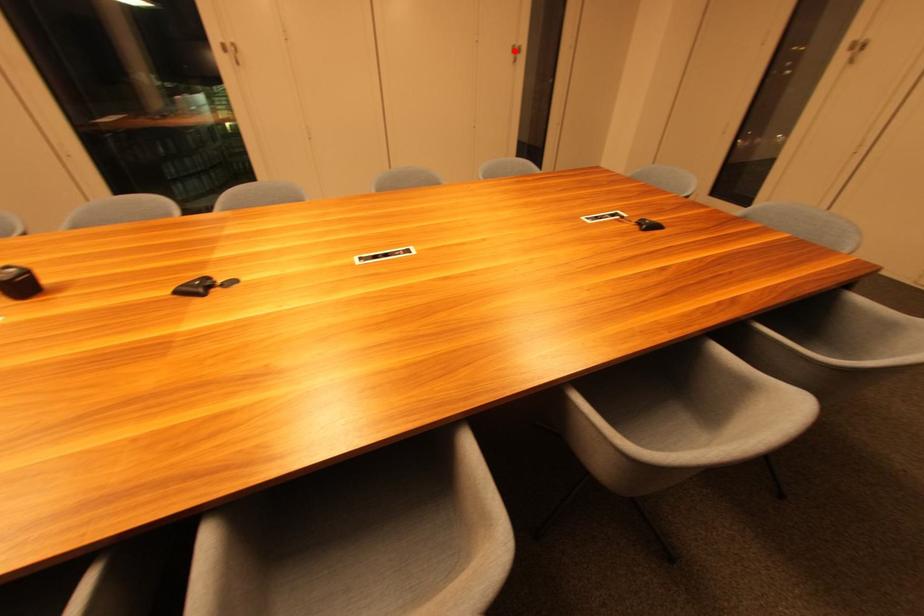
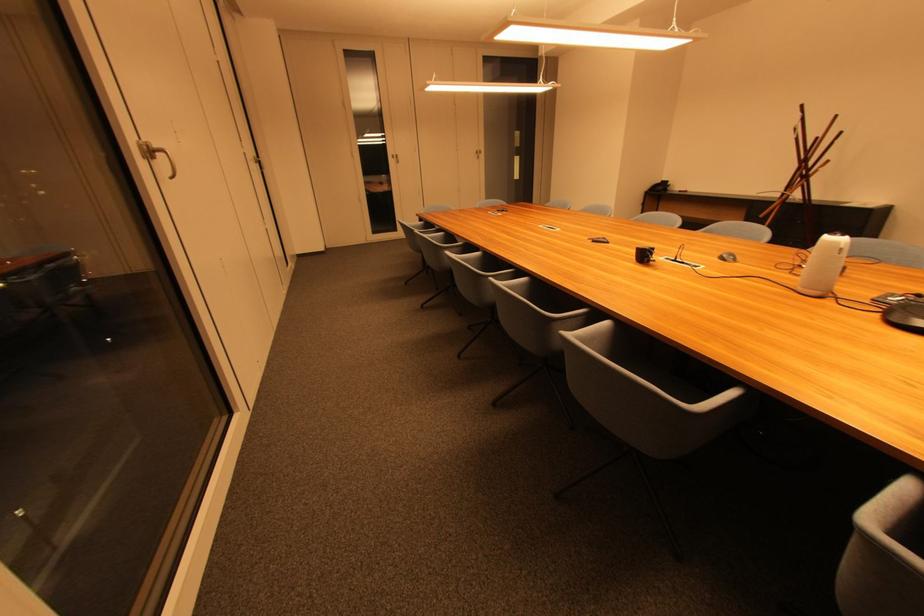
Locate, in the second image, the point that corresponds to the highlighted location in the first image.

(259, 163)